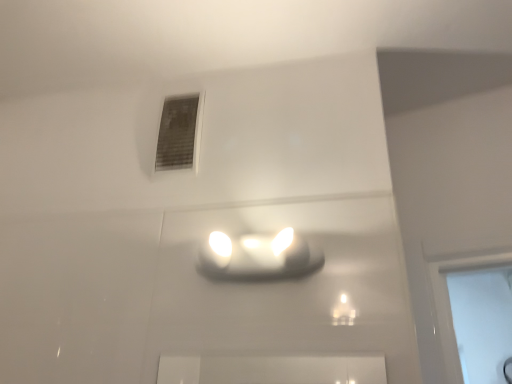
Question: Is matte white lamp at center shorter than matte gray vent at upper center?

Choices:
 (A) no
 (B) yes

Answer: (B)

Question: Is matte white lamp at center oriented towards matte gray vent at upper center?

Choices:
 (A) yes
 (B) no

Answer: (B)

Question: Does matte white lamp at center have a larger size compared to matte gray vent at upper center?

Choices:
 (A) no
 (B) yes

Answer: (B)

Question: Is matte white lamp at center taller than matte gray vent at upper center?

Choices:
 (A) no
 (B) yes

Answer: (A)

Question: Does matte white lamp at center have a lesser width compared to matte gray vent at upper center?

Choices:
 (A) no
 (B) yes

Answer: (A)

Question: Does matte white lamp at center lie behind matte gray vent at upper center?

Choices:
 (A) yes
 (B) no

Answer: (B)

Question: Is matte gray vent at upper center facing away from matte white lamp at center?

Choices:
 (A) yes
 (B) no

Answer: (B)

Question: From the image's perspective, is matte gray vent at upper center below matte white lamp at center?

Choices:
 (A) yes
 (B) no

Answer: (B)

Question: From a real-world perspective, is matte gray vent at upper center beneath matte white lamp at center?

Choices:
 (A) yes
 (B) no

Answer: (B)

Question: Is matte gray vent at upper center positioned in front of matte white lamp at center?

Choices:
 (A) no
 (B) yes

Answer: (A)

Question: Considering the relative positions of matte gray vent at upper center and matte white lamp at center in the image provided, is matte gray vent at upper center to the left of matte white lamp at center from the viewer's perspective?

Choices:
 (A) no
 (B) yes

Answer: (B)

Question: Is matte gray vent at upper center in contact with matte white lamp at center?

Choices:
 (A) yes
 (B) no

Answer: (B)

Question: Looking at the image, does matte gray vent at upper center seem bigger or smaller compared to matte white lamp at center?

Choices:
 (A) big
 (B) small

Answer: (B)